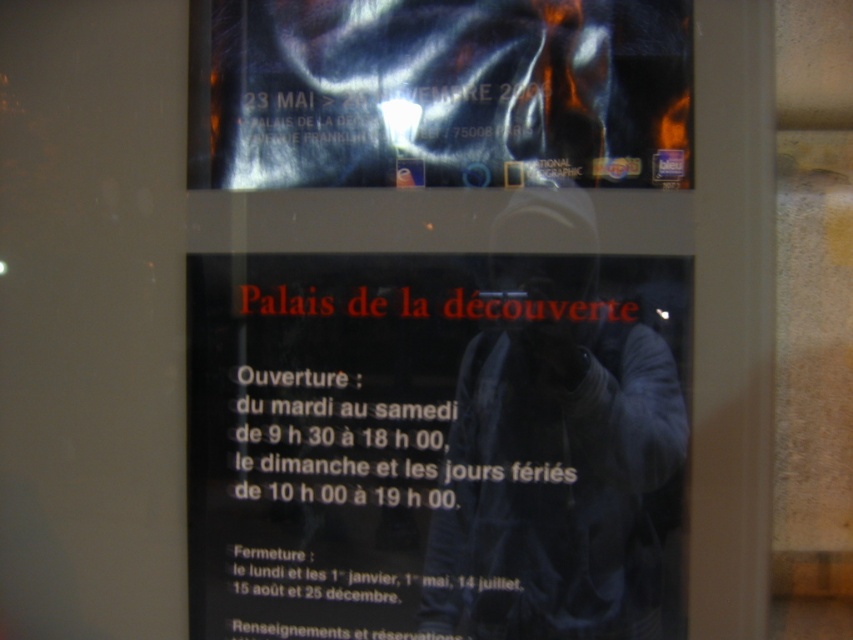
Between black paper at center and metallic reflective poster at upper center, which one is positioned lower?

black paper at center is below.

Does black paper at center appear under metallic reflective poster at upper center?

Correct, black paper at center is located below metallic reflective poster at upper center.

I want to click on black paper at center, so click(x=437, y=445).